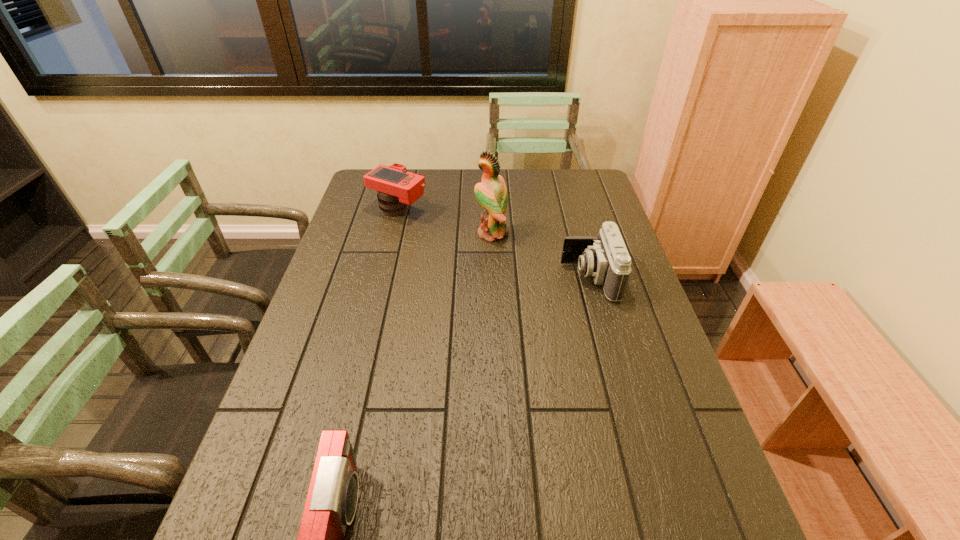
At what (x,y) coordinates should I click in order to perform the action: click on the tallest object. Please return your answer as a coordinate pair (x, y). Looking at the image, I should click on (491, 193).

Find the location of a particular element. This screenshot has height=540, width=960. parrot is located at coordinates 491,193.

Identify the location of the farthest camera. (397, 188).

Identify the location of the second farthest camera. (605, 258).

Identify the location of the rightmost camera. (605, 258).

I want to click on free location located 0.170m on the front-facing side of the tallest object, so click(x=423, y=233).

Find the location of `vacant position located on the front-facing side of the tallest object`. vacant position located on the front-facing side of the tallest object is located at coordinates (429, 233).

At what (x,y) coordinates should I click in order to perform the action: click on vacant space located on the front-facing side of the tallest object. Please return your answer as a coordinate pair (x, y). Looking at the image, I should click on (369, 233).

Identify the location of free location located 0.280m on the right of the farthest camera. This screenshot has width=960, height=540. (507, 210).

Where is `vacant space situated 0.140m at the front of the second nearest camera with an open lens cover`? The width and height of the screenshot is (960, 540). vacant space situated 0.140m at the front of the second nearest camera with an open lens cover is located at coordinates pyautogui.click(x=516, y=278).